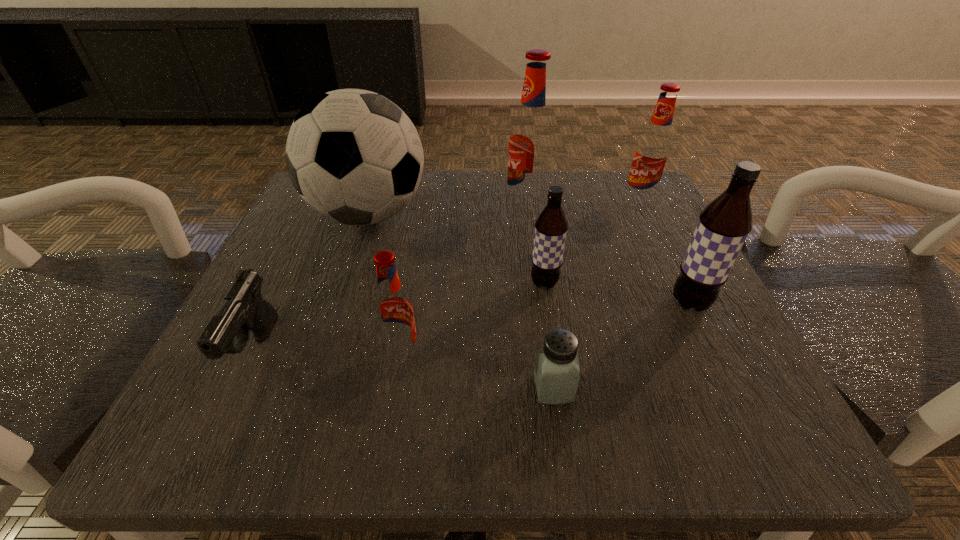
Find the location of a particular element. The image size is (960, 540). soccer ball that is at the left edge is located at coordinates (354, 156).

At what (x,y) coordinates should I click in order to perform the action: click on pistol located at the left edge. Please return your answer as a coordinate pair (x, y). The width and height of the screenshot is (960, 540). Looking at the image, I should click on (244, 309).

Find the location of a particular element. The height and width of the screenshot is (540, 960). object at the far left corner is located at coordinates (354, 156).

In order to click on object that is at the near left corner in this screenshot , I will do `click(244, 309)`.

The image size is (960, 540). In order to click on object that is at the far right corner in this screenshot , I will do `click(652, 153)`.

The width and height of the screenshot is (960, 540). I want to click on vacant space at the far edge of the desktop, so click(x=441, y=171).

Where is `blank space at the near edge`? The width and height of the screenshot is (960, 540). blank space at the near edge is located at coordinates (450, 436).

Where is `free space at the left edge`? Image resolution: width=960 pixels, height=540 pixels. free space at the left edge is located at coordinates (263, 362).

I want to click on vacant space at the right edge of the desktop, so click(x=743, y=358).

Find the location of `free space at the far left corner of the desktop`. free space at the far left corner of the desktop is located at coordinates (357, 234).